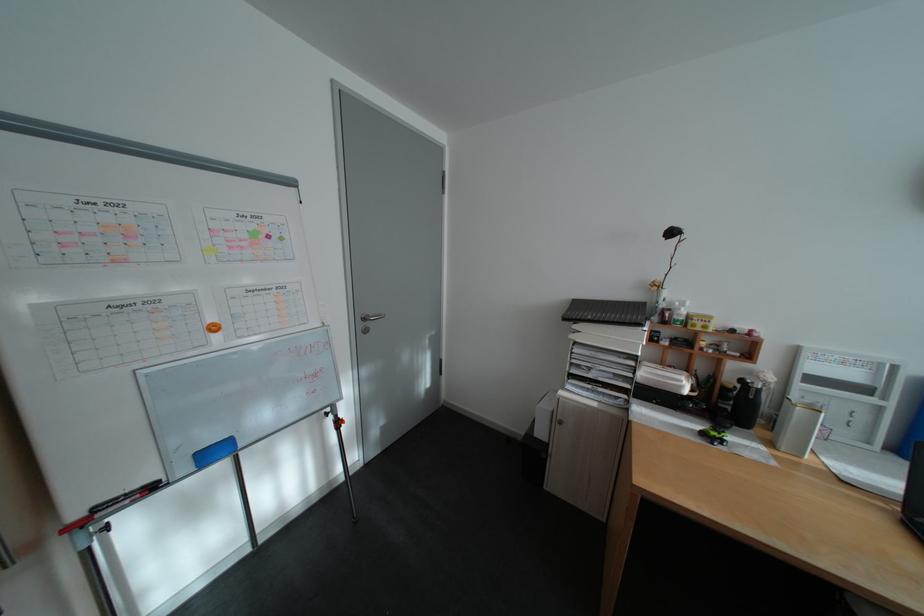
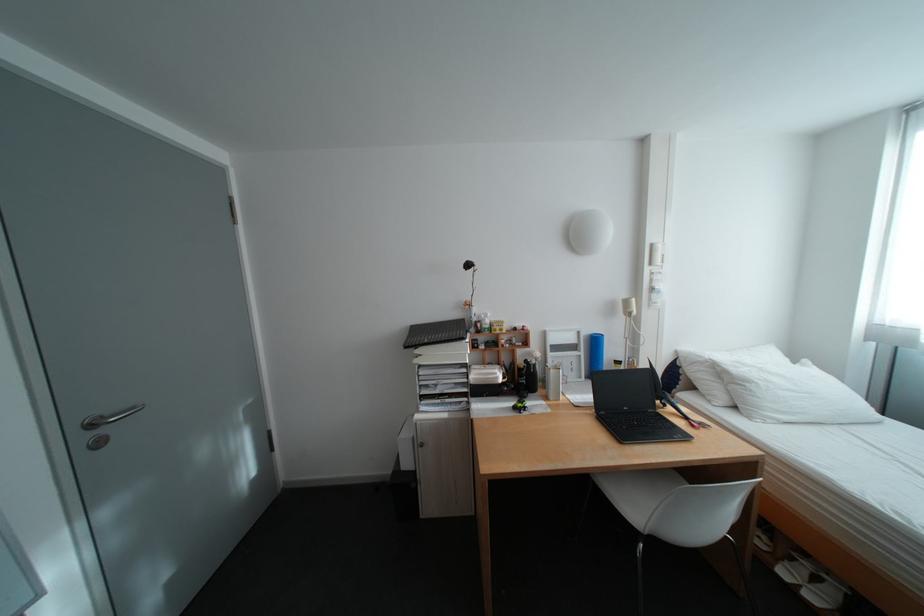
Find the pixel in the second image that matches [381,317] in the first image.

(115, 418)